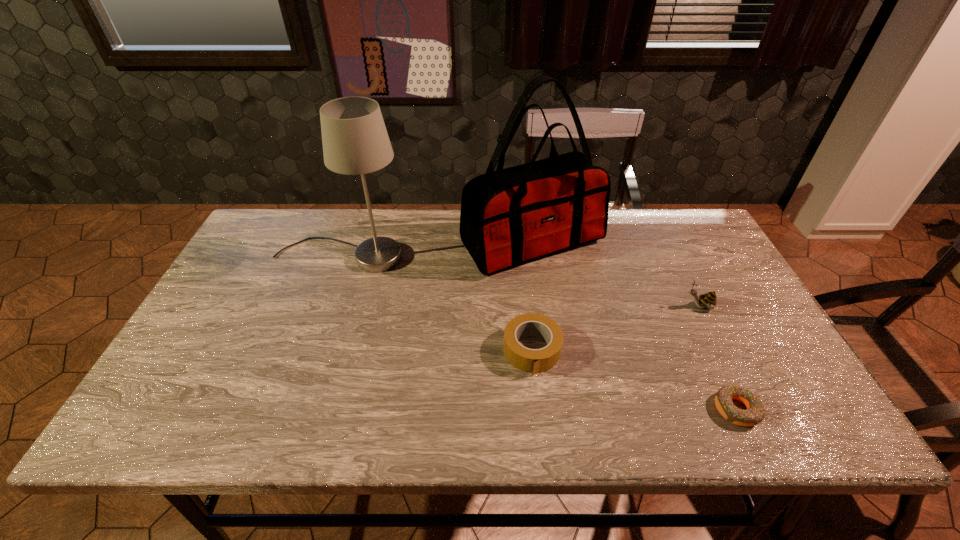
The image size is (960, 540). Find the location of `doughnut at the right edge`. doughnut at the right edge is located at coordinates (x=754, y=414).

You are a GUI agent. You are given a task and a screenshot of the screen. Output one action in this format:
    pyautogui.click(x=<x>, y=<y>)
    Task: Click on the object that is positioned at the far left corner
    
    Given the screenshot: What is the action you would take?
    pyautogui.click(x=355, y=141)

The width and height of the screenshot is (960, 540). Find the location of `object that is at the near right corner`. object that is at the near right corner is located at coordinates tap(754, 414).

At what (x,y) coordinates should I click in order to perform the action: click on vacant space at the far edge of the desktop. Please return your answer as a coordinate pair (x, y). This screenshot has height=540, width=960. Looking at the image, I should click on (420, 241).

Identify the location of free location at the near edge of the desktop. (300, 436).

This screenshot has height=540, width=960. In order to click on vacant region at the right edge in this screenshot , I will do pyautogui.click(x=747, y=367).

The width and height of the screenshot is (960, 540). What are the coordinates of `vacant space at the far right corner` in the screenshot? It's located at (682, 212).

In the image, there is a desktop. Find the location of `vacant space at the near right corner`. vacant space at the near right corner is located at coordinates tap(830, 431).

Where is `blank region between the duct tape and the duffel bag`? blank region between the duct tape and the duffel bag is located at coordinates (532, 296).

This screenshot has width=960, height=540. What are the coordinates of `vacant point located between the second shortest object and the duffel bag` in the screenshot? It's located at (532, 296).